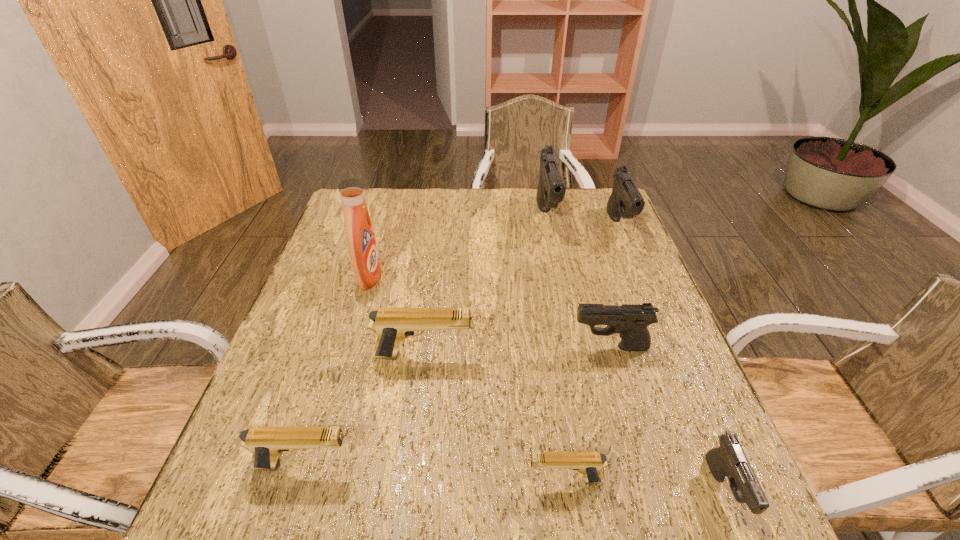
The width and height of the screenshot is (960, 540). What are the coordinates of `detergent` in the screenshot? It's located at (362, 246).

Locate an element on the screen. The width and height of the screenshot is (960, 540). the tallest object is located at coordinates (362, 246).

I want to click on the tallest pistol, so click(x=551, y=190).

Where is `the biggest black pistol`? Image resolution: width=960 pixels, height=540 pixels. the biggest black pistol is located at coordinates [551, 190].

Find the location of a particular element. the sixth shortest object is located at coordinates (626, 201).

This screenshot has height=540, width=960. Find the location of `the second biggest black pistol`. the second biggest black pistol is located at coordinates (626, 201).

Identify the location of the biggest tan pistol. The height and width of the screenshot is (540, 960). (392, 325).

Find the location of `the third biggest black pistol`. the third biggest black pistol is located at coordinates (x=631, y=321).

Locate an element on the screen. The height and width of the screenshot is (540, 960). the second smallest tan pistol is located at coordinates (266, 444).

The width and height of the screenshot is (960, 540). Identify the location of the smallest black pistol. (729, 460).